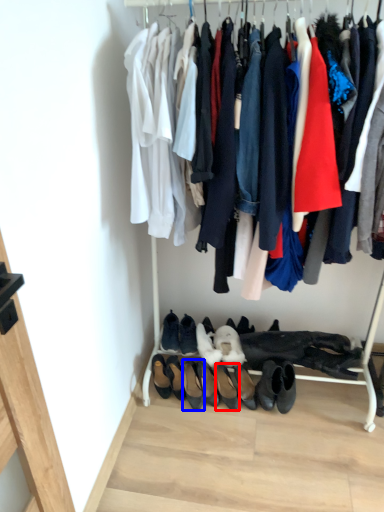
Question: Which point is further to the camera, footwear (highlighted by a red box) or footwear (highlighted by a blue box)?

Choices:
 (A) footwear
 (B) footwear

Answer: (B)